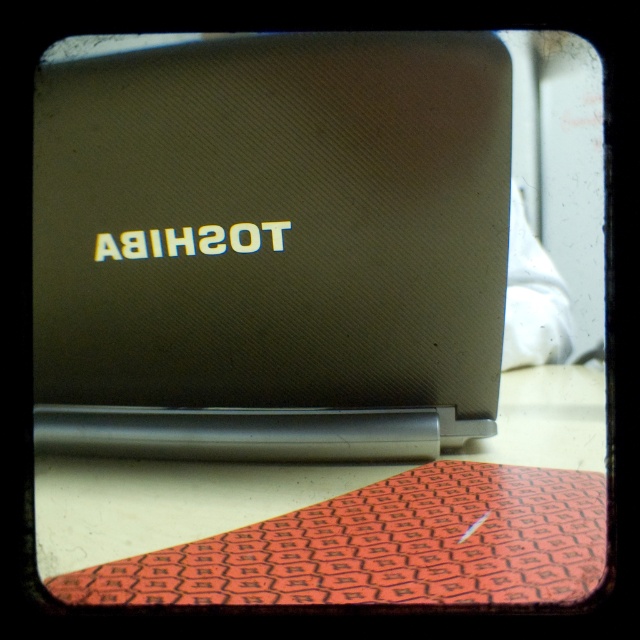
You are looking at the back panel of a Toshiba laptop. There are two points marked on the image, one at coordinates point (323, 211) and the other at point (563, 394). Which of these points is nearer to you?

Point (323, 211) is closer to the viewer than point (563, 394).

You are setting up a workspace and need to place the satin black laptop at center on top of the orange hexagonal patterned mat at lower center. Can the laptop fit on the mat without overhanging the edges?

The distance between the satin black laptop at center and orange hexagonal patterned mat at lower center is 4.10 inches. However, the question requires knowing the size of the laptop and mat to determine if it fits. Since the description only provides distance between them, not their dimensions, we cannot confirm if the laptop will fit on the mat without overhanging.

You are organizing items on a desk and need to place a new item between the satin black laptop at center and the orange hexagonal patterned mat at lower center. Based on their positions, where should you place the new item?

Since the satin black laptop at center is to the left of the orange hexagonal patterned mat at lower center, you should place the new item between them, to the right of the laptop and to the left of the mat.